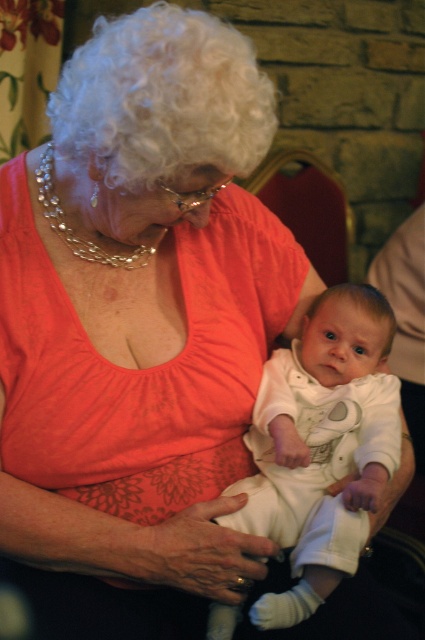
Between white cotton onesie at center and white curly wig at upper left, which one has less height?

white curly wig at upper left is shorter.

Is point (299, 564) farther from camera compared to point (212, 112)?

Yes, it is.

Who is more distant from viewer, (317,445) or (155,100)?

The point (317,445) is behind.

This screenshot has height=640, width=425. In order to click on white cotton onesie at center in this screenshot , I will do `click(320, 448)`.

Is point (76, 141) positioned behind point (303, 193)?

No.

This screenshot has width=425, height=640. Find the location of `white curly wig at upper left`. white curly wig at upper left is located at coordinates (163, 97).

Who is positioned more to the right, white cotton onesie at center or velvet red chair at center?

Result: From the viewer's perspective, velvet red chair at center appears more on the right side.

Who is positioned more to the left, white cotton onesie at center or velvet red chair at center?

From the viewer's perspective, white cotton onesie at center appears more on the left side.

What do you see at coordinates (320, 448) in the screenshot? The image size is (425, 640). I see `white cotton onesie at center` at bounding box center [320, 448].

Identify the location of white cotton onesie at center. Image resolution: width=425 pixels, height=640 pixels. (320, 448).